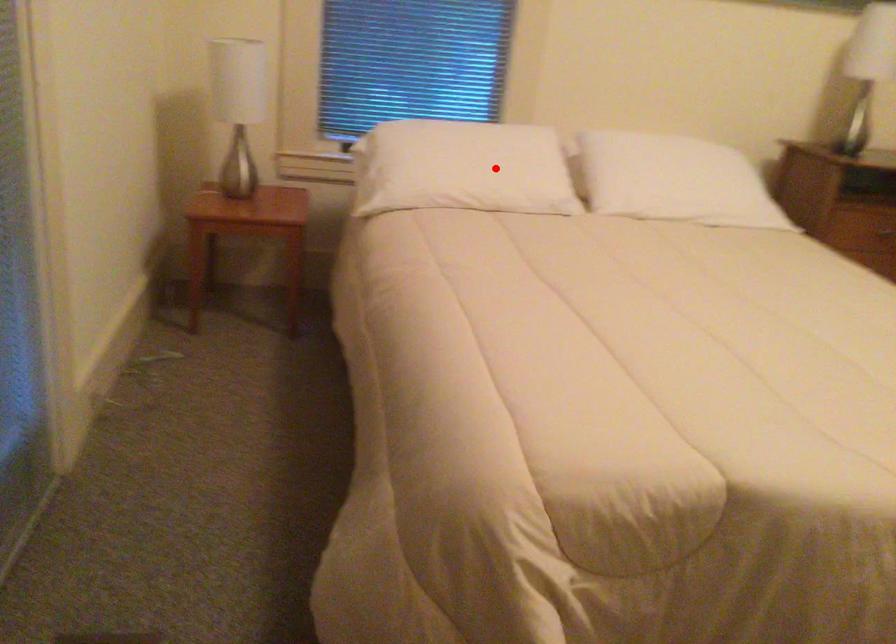
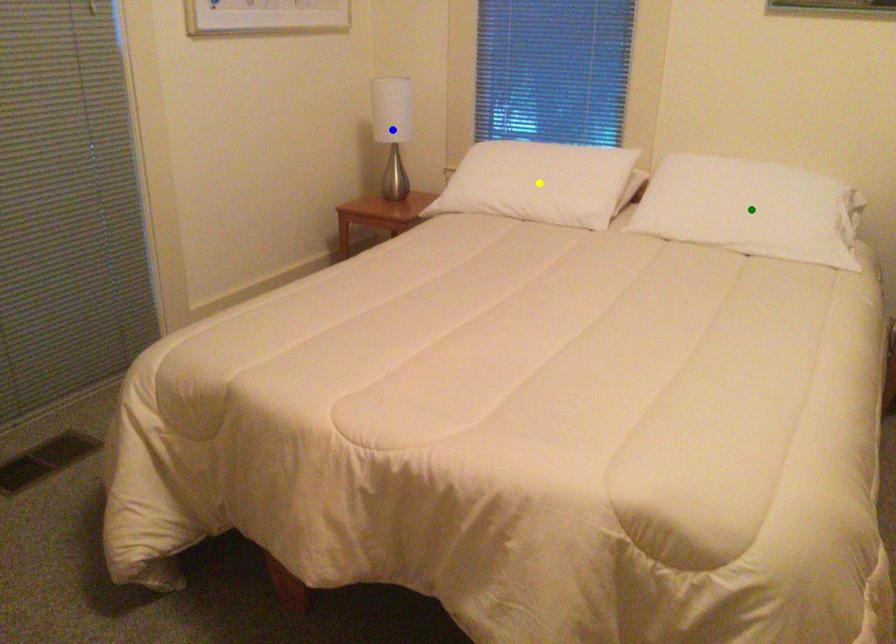
Question: I am providing you with two images of the same scene from different viewpoints. A red point is marked on the first image. You are given multiple points on the second image. In image 2, which mark is for the same physical point as the one in image 1?

Choices:
 (A) yellow point
 (B) green point
 (C) blue point

Answer: (A)